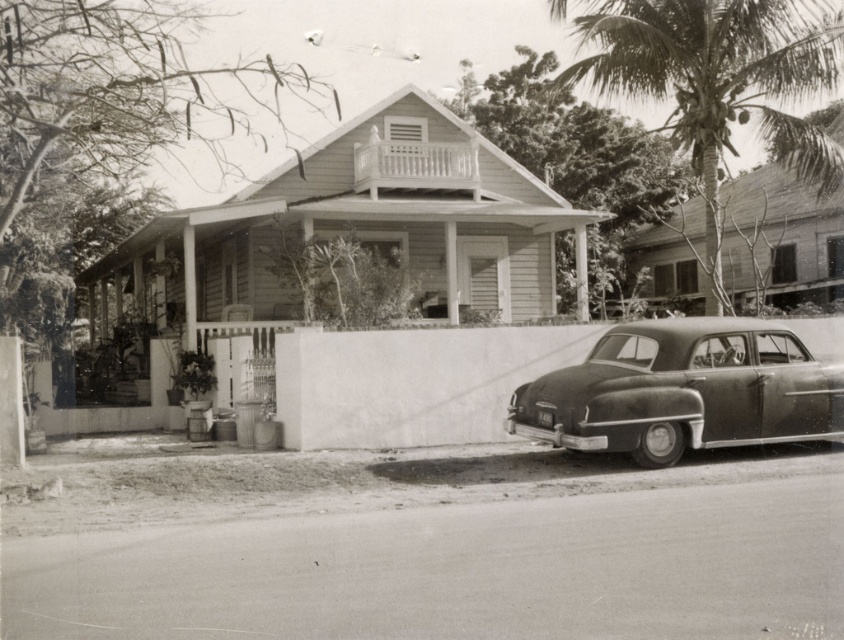
Is coarse textured palm tree at upper right to the right of white wooden porch at upper center from the viewer's perspective?

Correct, you'll find coarse textured palm tree at upper right to the right of white wooden porch at upper center.

Does coarse textured palm tree at upper right have a lesser height compared to white wooden porch at upper center?

No.

Is point (633, 72) closer to camera compared to point (458, 157)?

Yes.

Where is `coarse textured palm tree at upper right`? The width and height of the screenshot is (844, 640). coarse textured palm tree at upper right is located at coordinates (718, 83).

Does coarse textured palm tree at upper right have a lesser height compared to shiny black sedan at lower right?

Incorrect, coarse textured palm tree at upper right's height does not fall short of shiny black sedan at lower right's.

Can you confirm if coarse textured palm tree at upper right is positioned below shiny black sedan at lower right?

Incorrect, coarse textured palm tree at upper right is not positioned below shiny black sedan at lower right.

Find the location of a particular element. coarse textured palm tree at upper right is located at coordinates (718, 83).

Locate an element on the screen. coarse textured palm tree at upper right is located at coordinates (718, 83).

Does shiny black sedan at lower right have a lesser width compared to white wooden porch at upper center?

Incorrect, shiny black sedan at lower right's width is not less than white wooden porch at upper center's.

Who is higher up, shiny black sedan at lower right or white wooden porch at upper center?

Positioned higher is white wooden porch at upper center.

The height and width of the screenshot is (640, 844). What do you see at coordinates (683, 392) in the screenshot?
I see `shiny black sedan at lower right` at bounding box center [683, 392].

You are a GUI agent. You are given a task and a screenshot of the screen. Output one action in this format:
    pyautogui.click(x=<x>, y=<y>)
    Task: Click on the shiny black sedan at lower right
    This screenshot has width=844, height=640.
    Given the screenshot: What is the action you would take?
    pyautogui.click(x=683, y=392)